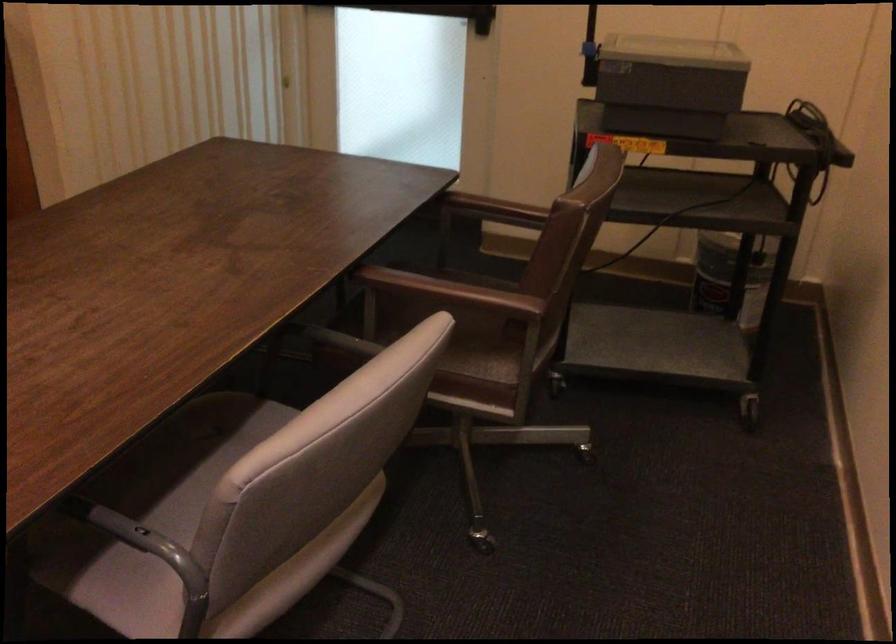
Locate an element on the screen. The width and height of the screenshot is (896, 644). brown chair sitting surface is located at coordinates (477, 335).